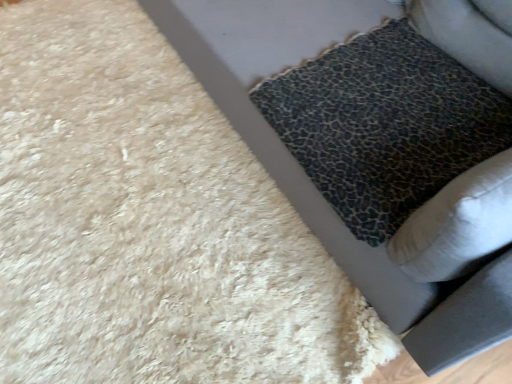
Question: Does leather-textured cushion at lower right have a larger size compared to leopard print cushion at lower right?

Choices:
 (A) no
 (B) yes

Answer: (B)

Question: From the image's perspective, is leather-textured cushion at lower right on top of leopard print cushion at lower right?

Choices:
 (A) no
 (B) yes

Answer: (B)

Question: Is leather-textured cushion at lower right positioned before leopard print cushion at lower right?

Choices:
 (A) no
 (B) yes

Answer: (B)

Question: Can you confirm if leather-textured cushion at lower right is shorter than leopard print cushion at lower right?

Choices:
 (A) yes
 (B) no

Answer: (B)

Question: Is leather-textured cushion at lower right completely or partially outside of leopard print cushion at lower right?

Choices:
 (A) yes
 (B) no

Answer: (A)

Question: Does leather-textured cushion at lower right have a smaller size compared to leopard print cushion at lower right?

Choices:
 (A) no
 (B) yes

Answer: (A)

Question: From the image's perspective, is leopard print cushion at lower right located beneath leather-textured cushion at lower right?

Choices:
 (A) yes
 (B) no

Answer: (A)

Question: From a real-world perspective, does leopard print cushion at lower right sit lower than leather-textured cushion at lower right?

Choices:
 (A) yes
 (B) no

Answer: (A)

Question: Can you confirm if leopard print cushion at lower right is wider than leather-textured cushion at lower right?

Choices:
 (A) yes
 (B) no

Answer: (B)

Question: Does leopard print cushion at lower right come in front of leather-textured cushion at lower right?

Choices:
 (A) yes
 (B) no

Answer: (B)

Question: Can you confirm if leopard print cushion at lower right is taller than leather-textured cushion at lower right?

Choices:
 (A) no
 (B) yes

Answer: (A)

Question: Is leopard print cushion at lower right outside of leather-textured cushion at lower right?

Choices:
 (A) no
 (B) yes

Answer: (A)

Question: From a real-world perspective, is leather-textured cushion at lower right above or below leopard print cushion at lower right?

Choices:
 (A) below
 (B) above

Answer: (B)